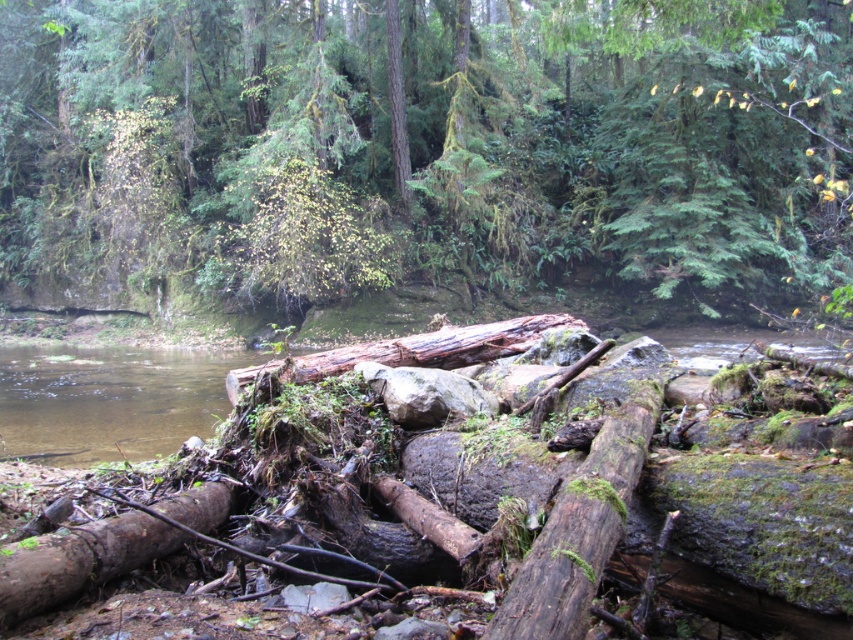
Question: Does moss-covered wood at center have a lesser width compared to brown rough log at lower left?

Choices:
 (A) yes
 (B) no

Answer: (B)

Question: Can you confirm if green mossy log at center is positioned above moss-covered wood at center?

Choices:
 (A) no
 (B) yes

Answer: (B)

Question: Is moss-covered wood at center bigger than brown rough log at lower left?

Choices:
 (A) yes
 (B) no

Answer: (A)

Question: Which object is closer to the camera taking this photo?

Choices:
 (A) green mossy log at center
 (B) brown rough log at lower left

Answer: (B)

Question: Which of the following is the farthest from the observer?

Choices:
 (A) brown rough log at lower left
 (B) moss-covered wood at center
 (C) green mossy log at center

Answer: (C)

Question: Which object is the farthest from the moss-covered wood at center?

Choices:
 (A) brown rough log at lower left
 (B) green mossy log at center

Answer: (B)